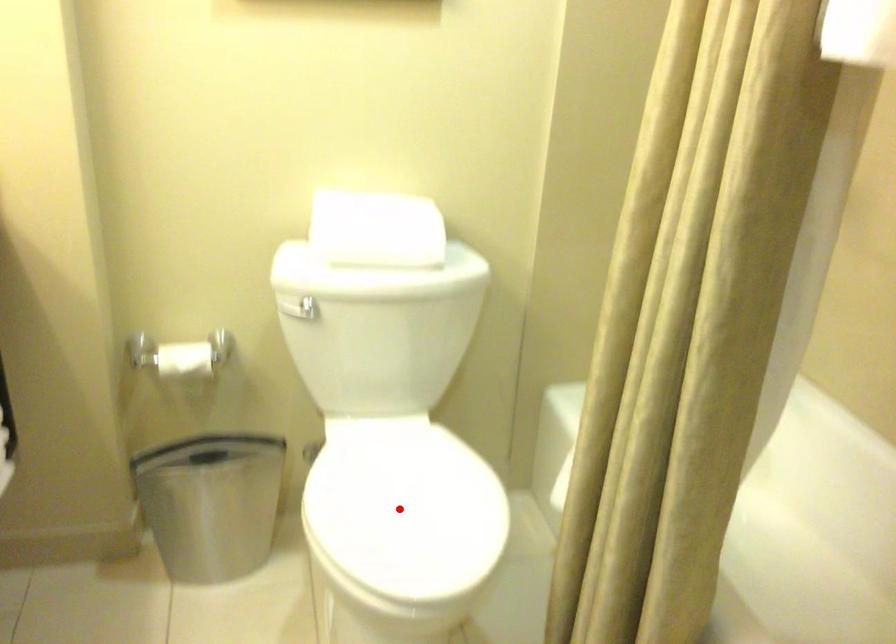
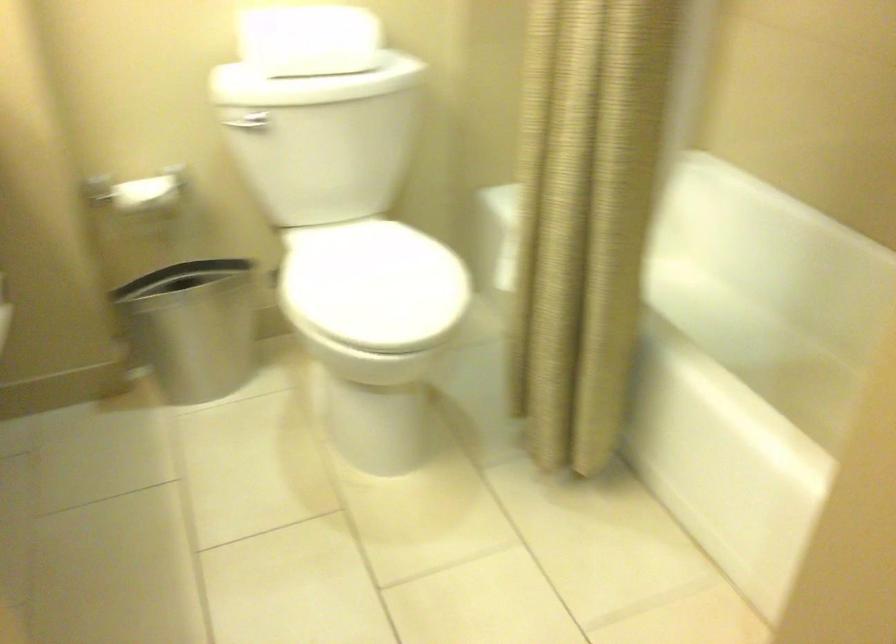
Find the pixel in the second image that matches the highlighted location in the first image.

(372, 285)